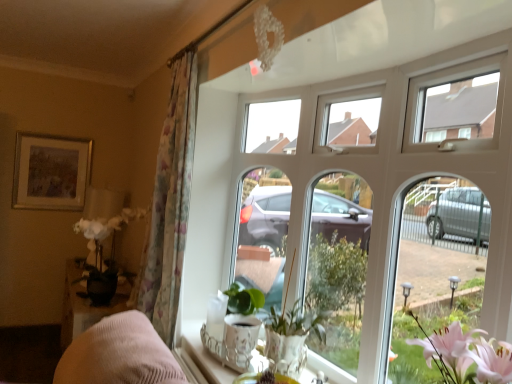
I want to click on translucent glass vase at lower center, so click(239, 340).

At what (x,y) coordinates should I click in order to perform the action: click on white glass window at center. Please return your answer as a coordinate pair (x, y). Image resolution: width=512 pixels, height=384 pixels. Looking at the image, I should click on (362, 184).

Describe the element at coordinates (51, 172) in the screenshot. This screenshot has width=512, height=384. I see `gold-framed painting at upper left` at that location.

Locate an element on the screen. The width and height of the screenshot is (512, 384). translucent glass vase at lower center is located at coordinates (239, 340).

Is floral fabric curtain at left to the left or to the right of white ceramic tray at lower center in the image?

Based on their positions, floral fabric curtain at left is located to the left of white ceramic tray at lower center.

Considering the sizes of objects floral fabric curtain at left and white ceramic tray at lower center in the image provided, who is smaller, floral fabric curtain at left or white ceramic tray at lower center?

Smaller between the two is white ceramic tray at lower center.

Is white ceramic tray at lower center at the back of floral fabric curtain at left?

No.

In the scene shown: Considering the sizes of objects floral fabric curtain at left and white ceramic tray at lower center in the image provided, who is taller, floral fabric curtain at left or white ceramic tray at lower center?

floral fabric curtain at left is taller.

Can you confirm if white glass window at center is bigger than white ceramic tray at lower center?

Indeed, white glass window at center has a larger size compared to white ceramic tray at lower center.

From a real-world perspective, is white glass window at center physically below white ceramic tray at lower center?

No.

You are a GUI agent. You are given a task and a screenshot of the screen. Output one action in this format:
    pyautogui.click(x=<x>, y=<y>)
    Task: Click on the window sill beneath the white glass window at center (from a real-world perspective)
    The image size is (512, 384).
    Given the screenshot: What is the action you would take?
    pyautogui.click(x=204, y=355)

From the image's perspective, between green matte plant at center and floral fabric curtain at left, which one is located above?

From the image's view, floral fabric curtain at left is above.

From a real-world perspective, relative to floral fabric curtain at left, is green matte plant at center vertically above or below?

Clearly, from a real-world perspective, green matte plant at center is below floral fabric curtain at left.

Based on the photo, could you tell me if green matte plant at center is facing floral fabric curtain at left?

No, green matte plant at center does not turn towards floral fabric curtain at left.

Which is nearer, (x=274, y=342) or (x=175, y=248)?

The point (x=274, y=342) is closer to the camera.

Which is more to the left, translucent glass vase at lower center or floral fabric curtain at left?

Positioned to the left is floral fabric curtain at left.

Based on the photo, is translucent glass vase at lower center oriented towards floral fabric curtain at left?

No, translucent glass vase at lower center is not facing towards floral fabric curtain at left.

Based on the photo, from the image's perspective, which is above, translucent glass vase at lower center or floral fabric curtain at left?

From the image's view, floral fabric curtain at left is above.

In order to click on picture frame that appears above the floral fabric curtain at left (from the image's perspective) in this screenshot , I will do `click(51, 172)`.

From a real-world perspective, which is physically below, floral fabric curtain at left or gold-framed painting at upper left?

From a 3D spatial view, gold-framed painting at upper left is below.

Which is more to the right, floral fabric curtain at left or gold-framed painting at upper left?

Positioned to the right is floral fabric curtain at left.

Considering the sizes of objects floral fabric curtain at left and gold-framed painting at upper left in the image provided, who is smaller, floral fabric curtain at left or gold-framed painting at upper left?

gold-framed painting at upper left is smaller.

From the image's perspective, is white ceramic tray at lower center located above white glass window at center?

No, from the image's perspective, white ceramic tray at lower center is not over white glass window at center.

In the scene shown: Is white ceramic tray at lower center oriented away from white glass window at center?

Absolutely, white ceramic tray at lower center is directed away from white glass window at center.

In order to click on window above the white ceramic tray at lower center (from a real-world perspective) in this screenshot , I will do `click(362, 184)`.

Looking at the image, does white ceramic tray at lower center seem bigger or smaller compared to white glass window at center?

Considering their sizes, white ceramic tray at lower center takes up less space than white glass window at center.

Between white ceramic tray at lower center and green matte plant at center, which one appears on the right side from the viewer's perspective?

From the viewer's perspective, green matte plant at center appears more on the right side.

Is white ceramic tray at lower center facing towards green matte plant at center?

No, white ceramic tray at lower center is not turned towards green matte plant at center.

Could green matte plant at center be considered to be inside white ceramic tray at lower center?

No.

Locate an element on the screen. This screenshot has width=512, height=384. curtain above the white ceramic tray at lower center (from the image's perspective) is located at coordinates coord(169,205).

At what (x,y) coordinates should I click in order to perform the action: click on window above the white ceramic tray at lower center (from a real-world perspective). Please return your answer as a coordinate pair (x, y). This screenshot has height=384, width=512. Looking at the image, I should click on (362, 184).

Based on their spatial positions, is floral fabric curtain at left or translucent glass vase at lower center closer to green matte plant at center?

translucent glass vase at lower center lies closer to green matte plant at center than the other object.

Based on their spatial positions, is white glass window at center or floral fabric curtain at left further from green matte plant at center?

Among the two, floral fabric curtain at left is located further to green matte plant at center.

Consider the image. Looking at the image, which one is located further to white ceramic tray at lower center, floral fabric curtain at left or green matte plant at center?

floral fabric curtain at left is further to white ceramic tray at lower center.

Considering their positions, is green matte plant at center positioned further to gold-framed painting at upper left than floral fabric curtain at left?

green matte plant at center.

Which object lies nearer to the anchor point gold-framed painting at upper left, green matte plant at center or white glass window at center?

The object closer to gold-framed painting at upper left is white glass window at center.

From the image, which object appears to be nearer to green matte plant at center, white ceramic tray at lower center or translucent glass vase at lower center?

translucent glass vase at lower center lies closer to green matte plant at center than the other object.

Based on their spatial positions, is white ceramic tray at lower center or gold-framed painting at upper left closer to floral fabric curtain at left?

The object closer to floral fabric curtain at left is white ceramic tray at lower center.

When comparing their distances from gold-framed painting at upper left, does white ceramic tray at lower center or floral fabric curtain at left seem closer?

Based on the image, floral fabric curtain at left appears to be nearer to gold-framed painting at upper left.

You are a GUI agent. You are given a task and a screenshot of the screen. Output one action in this format:
    pyautogui.click(x=<x>, y=<y>)
    Task: Click on the curtain between white ceramic tray at lower center and gold-framed painting at upper left from front to back
    
    Given the screenshot: What is the action you would take?
    pyautogui.click(x=169, y=205)

Identify the location of houseplant between white glass window at center and gold-framed painting at upper left along the z-axis. (291, 338).

Find the location of a particular element. This screenshot has height=384, width=512. glass vase situated between white ceramic tray at lower center and green matte plant at center from left to right is located at coordinates (239, 340).

Where is `window sill between white glass window at center and translucent glass vase at lower center from front to back`? window sill between white glass window at center and translucent glass vase at lower center from front to back is located at coordinates (204, 355).